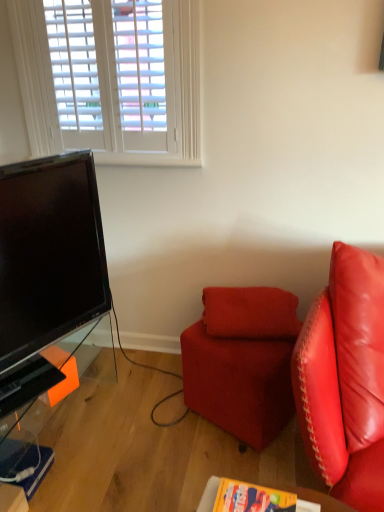
Question: In terms of size, does suede-like red pillow at center appear bigger or smaller than transparent glass table at lower left, which is the 1th table from back to front?

Choices:
 (A) small
 (B) big

Answer: (A)

Question: Considering the positions of suede-like red pillow at center and transparent glass table at lower left, positioned as the 2th table in front-to-back order, in the image, is suede-like red pillow at center wider or thinner than transparent glass table at lower left, positioned as the 2th table in front-to-back order,?

Choices:
 (A) wide
 (B) thin

Answer: (B)

Question: Estimate the real-world distances between objects in this image. Which object is closer to the velvet red ottoman at center?

Choices:
 (A) suede-like red pillow at center
 (B) wooden table at lower center, which is counted as the first table, starting from the front
 (C) transparent glass table at lower left, the second table in the right-to-left sequence

Answer: (A)

Question: Which object is positioned closest to the velvet red ottoman at center?

Choices:
 (A) suede-like red pillow at center
 (B) transparent glass table at lower left, the second table in the right-to-left sequence
 (C) wooden table at lower center, which appears as the second table when viewed from the left

Answer: (A)